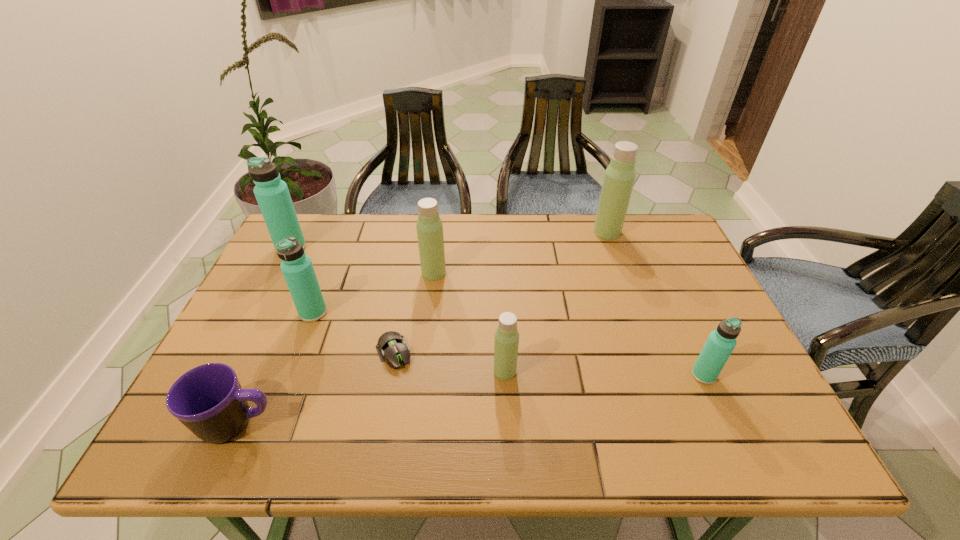
At what (x,y) coordinates should I click in order to perform the action: click on vacant region between the fourth farthest object and the nearest light thermos bottle. Please return your answer as a coordinate pair (x, y). The image size is (960, 540). Looking at the image, I should click on point(409,342).

Where is `empty space that is in between the black mug and the rightmost thermos bottle`? Image resolution: width=960 pixels, height=540 pixels. empty space that is in between the black mug and the rightmost thermos bottle is located at coordinates (471, 400).

Where is `free space between the fifth thermos bottle from right to left and the farthest light thermos bottle`? free space between the fifth thermos bottle from right to left and the farthest light thermos bottle is located at coordinates (460, 272).

Select which object is the closest to the fourth thermos bottle from left to right. Please provide its 2D coordinates. Your answer should be formatted as a tuple, i.e. [(x, y)], where the tuple contains the x and y coordinates of a point satisfying the conditions above.

[(392, 346)]

Choose which object is the third nearest neighbor to the fourth farthest thermos bottle. Please provide its 2D coordinates. Your answer should be formatted as a tuple, i.e. [(x, y)], where the tuple contains the x and y coordinates of a point satisfying the conditions above.

[(208, 399)]

Identify which thermos bottle is located as the nearest to the biggest aqua thermos bottle. Please provide its 2D coordinates. Your answer should be formatted as a tuple, i.e. [(x, y)], where the tuple contains the x and y coordinates of a point satisfying the conditions above.

[(297, 268)]

In order to click on thermos bottle that is the second closest to the seventh tallest object in this screenshot , I will do `click(506, 343)`.

You are a GUI agent. You are given a task and a screenshot of the screen. Output one action in this format:
    pyautogui.click(x=<x>, y=<y>)
    Task: Click on the light thermos bottle that is the closest to the third thermos bottle from right to left
    The width and height of the screenshot is (960, 540).
    Given the screenshot: What is the action you would take?
    pyautogui.click(x=429, y=226)

Locate which light thermos bottle is the third closest to the second farthest aqua thermos bottle. Please provide its 2D coordinates. Your answer should be formatted as a tuple, i.e. [(x, y)], where the tuple contains the x and y coordinates of a point satisfying the conditions above.

[(619, 178)]

Locate which aqua thermos bottle is the closest to the third object from right to left. Please provide its 2D coordinates. Your answer should be formatted as a tuple, i.e. [(x, y)], where the tuple contains the x and y coordinates of a point satisfying the conditions above.

[(721, 342)]